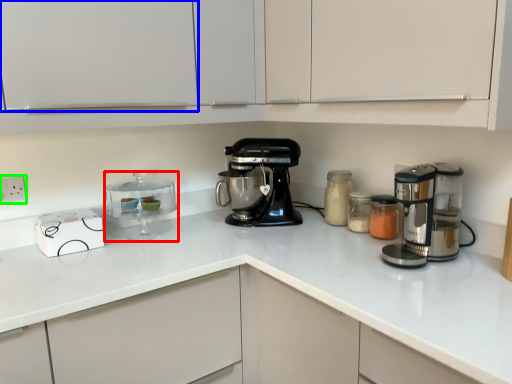
Question: Based on their relative distances, which object is nearer to appliance (highlighted by a red box)? Choose from cabinetry (highlighted by a blue box) and electric outlet (highlighted by a green box).

Choices:
 (A) cabinetry
 (B) electric outlet

Answer: (B)